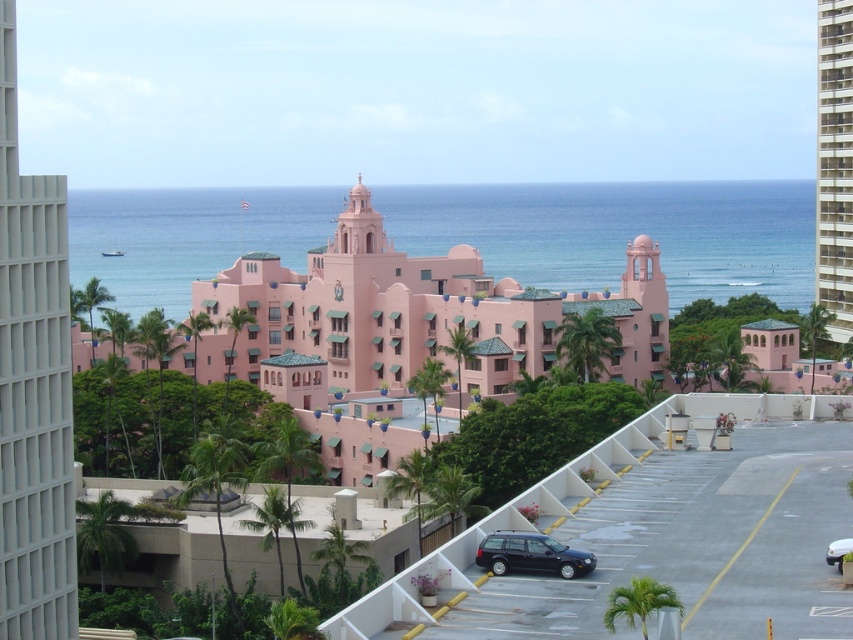
You are a tourist trying to find the entrance to the matte pink building at left. You see the dark blue matte station wagon at lower right parked nearby. Based on the scene, which direction should you walk from the station wagon to reach the building?

The matte pink building at left is to the left of the dark blue matte station wagon at lower right, so you should walk towards the left from the station wagon to reach the building.

You are a photographer planning to take a picture of the matte pink building at left and the dark blue matte station wagon at lower right. To ensure both are in frame, which object should you position closer to the camera?

The matte pink building at left is positioned over the dark blue matte station wagon at lower right, so you should position the matte pink building at left closer to the camera to ensure both are in frame.

You are a photographer planning to capture the matte pink building at left and the pink concrete building at right in a single frame. Based on their sizes, which building should you position closer to the camera to ensure both are visible in the frame without cropping?

The matte pink building at left is thinner than the pink concrete building at right, so positioning the pink concrete building at right closer to the camera would allow both buildings to fit within the frame while maintaining visibility.